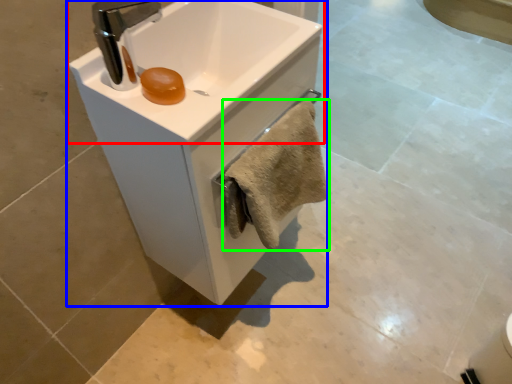
Question: Which object is the farthest from sink (highlighted by a red box)? Choose among these: sink (highlighted by a blue box) or bath towel (highlighted by a green box).

Choices:
 (A) sink
 (B) bath towel

Answer: (B)